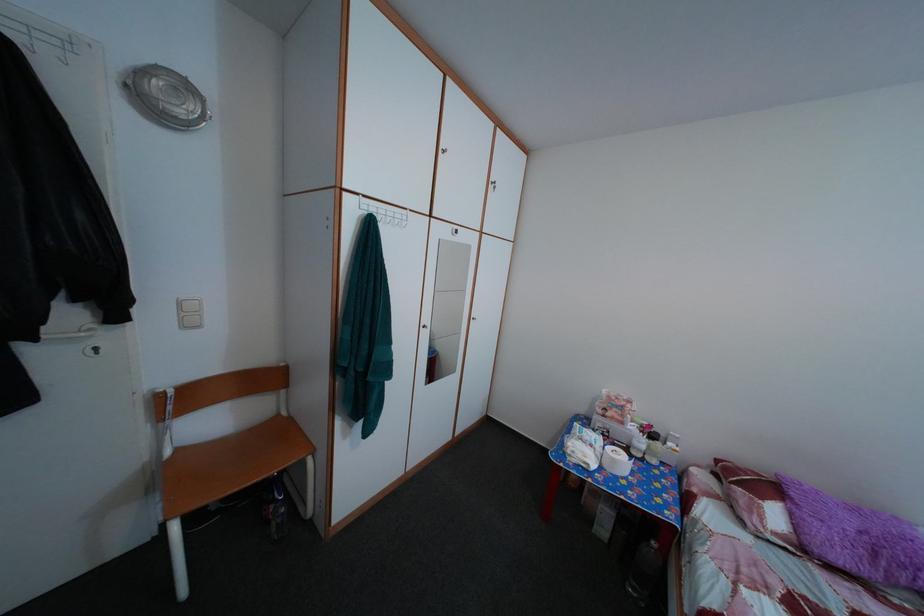
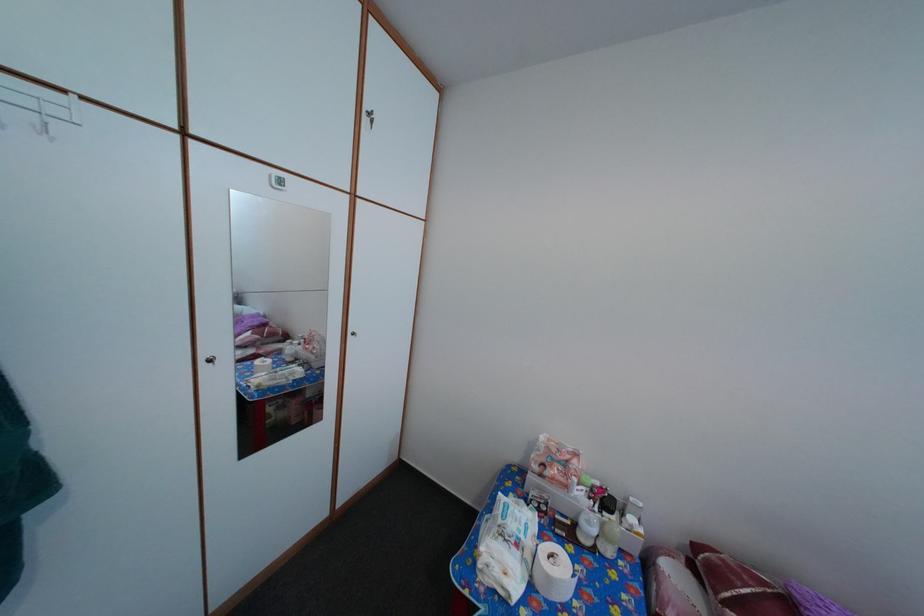
Locate, in the second image, the point that corresponds to (631,415) in the first image.

(576, 469)